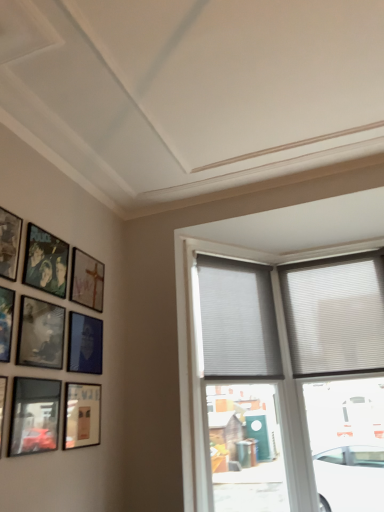
Question: From the image's perspective, does matte black picture frame at lower left, which ranks as the 9th picture frame in back-to-front order, appear lower than white textured blinds at upper right, which appears as the 2th window when viewed from the right?

Choices:
 (A) no
 (B) yes

Answer: (B)

Question: Is matte black picture frame at lower left, which ranks as the 9th picture frame in back-to-front order, at the right side of white textured blinds at upper right, which appears as the 2th window when viewed from the right?

Choices:
 (A) no
 (B) yes

Answer: (A)

Question: Is matte black picture frame at lower left, which ranks as the 9th picture frame in back-to-front order, behind white textured blinds at upper right, which appears as the second window when viewed from the left?

Choices:
 (A) no
 (B) yes

Answer: (A)

Question: From the image's perspective, does matte black picture frame at lower left, which ranks as the 9th picture frame in back-to-front order, appear higher than white textured blinds at upper right, which appears as the 2th window when viewed from the right?

Choices:
 (A) no
 (B) yes

Answer: (A)

Question: Can we say matte black picture frame at lower left, which ranks as the 9th picture frame in back-to-front order, lies outside white textured blinds at upper right, which appears as the 2th window when viewed from the right?

Choices:
 (A) yes
 (B) no

Answer: (A)

Question: Considering the relative sizes of matte black picture frame at lower left, which ranks as the 9th picture frame in back-to-front order, and white textured blinds at upper right, which appears as the 2th window when viewed from the right, in the image provided, is matte black picture frame at lower left, which ranks as the 9th picture frame in back-to-front order, bigger than white textured blinds at upper right, which appears as the 2th window when viewed from the right,?

Choices:
 (A) no
 (B) yes

Answer: (A)

Question: From a real-world perspective, is matte blue picture frame at lower left, placed as the eighth picture frame when sorted from front to back, beneath matte black picture frame at upper left, the 5th picture frame viewed from the back?

Choices:
 (A) no
 (B) yes

Answer: (B)

Question: Can you see matte blue picture frame at lower left, which ranks as the 2th picture frame in back-to-front order, touching matte black picture frame at upper left, the 5th picture frame viewed from the back?

Choices:
 (A) no
 (B) yes

Answer: (A)

Question: Would you say matte black picture frame at upper left, the 5th picture frame from the front, is part of matte blue picture frame at lower left, placed as the eighth picture frame when sorted from front to back,'s contents?

Choices:
 (A) yes
 (B) no

Answer: (B)

Question: Is matte blue picture frame at lower left, which ranks as the 2th picture frame in back-to-front order, positioned beyond the bounds of matte black picture frame at upper left, the 5th picture frame viewed from the back?

Choices:
 (A) no
 (B) yes

Answer: (B)

Question: Does matte blue picture frame at lower left, which ranks as the 2th picture frame in back-to-front order, come in front of matte black picture frame at upper left, the 5th picture frame viewed from the back?

Choices:
 (A) no
 (B) yes

Answer: (A)

Question: Does matte blue picture frame at lower left, which ranks as the 2th picture frame in back-to-front order, have a lesser width compared to matte black picture frame at upper left, the 5th picture frame viewed from the back?

Choices:
 (A) yes
 (B) no

Answer: (A)

Question: From the image's perspective, is matte blue picture frame at lower left, which ranks as the 2th picture frame in back-to-front order, under metallic silver picture frame at left, marked as the second picture frame in a front-to-back arrangement?

Choices:
 (A) yes
 (B) no

Answer: (A)